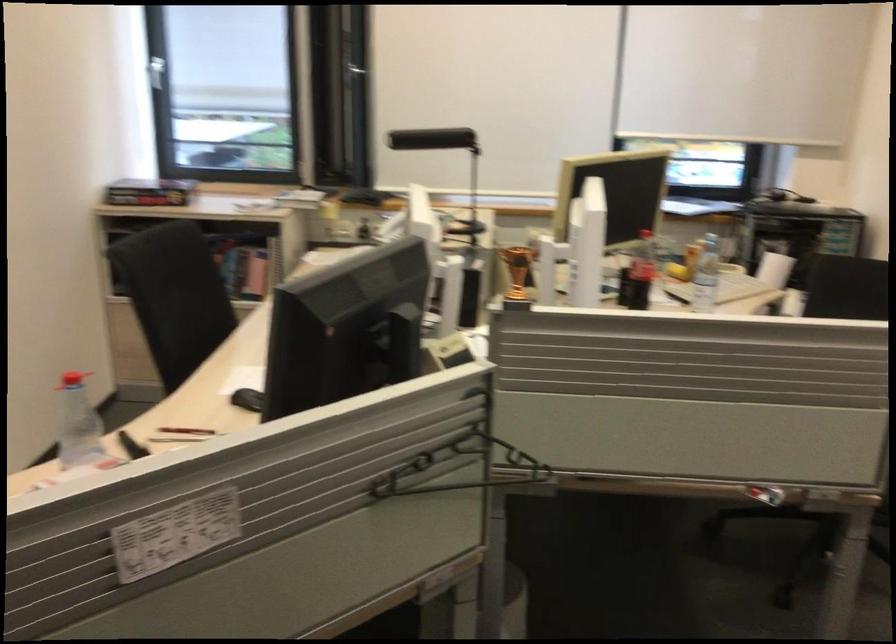
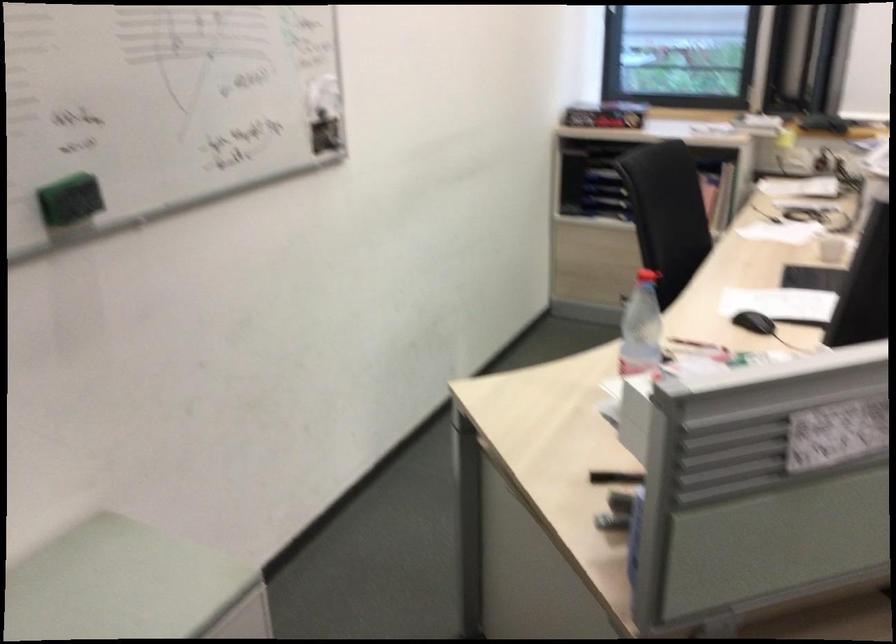
In the second image, find the point that corresponds to pixel 190 431 in the first image.

(695, 345)